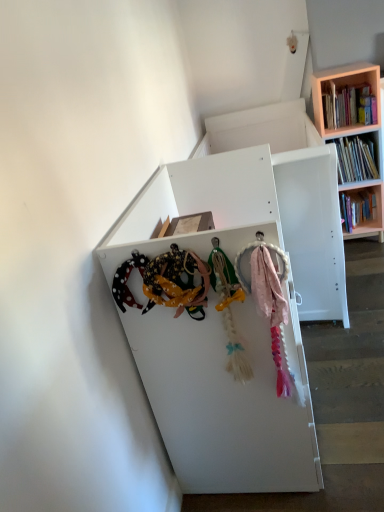
Question: Considering the relative sizes of white matte shelf at center and wooden bookshelf at upper right in the image provided, is white matte shelf at center smaller than wooden bookshelf at upper right?

Choices:
 (A) no
 (B) yes

Answer: (A)

Question: Is white matte shelf at center looking in the opposite direction of wooden bookshelf at upper right?

Choices:
 (A) yes
 (B) no

Answer: (B)

Question: Are white matte shelf at center and wooden bookshelf at upper right located far from each other?

Choices:
 (A) yes
 (B) no

Answer: (A)

Question: Is white matte shelf at center closer to the viewer compared to wooden bookshelf at upper right?

Choices:
 (A) no
 (B) yes

Answer: (B)

Question: Can you confirm if white matte shelf at center is wider than wooden bookshelf at upper right?

Choices:
 (A) yes
 (B) no

Answer: (A)

Question: Considering the relative sizes of white matte shelf at center and wooden bookshelf at upper right in the image provided, is white matte shelf at center taller than wooden bookshelf at upper right?

Choices:
 (A) yes
 (B) no

Answer: (B)

Question: Considering the relative positions of wooden bookshelf at upper right and wooden bookshelf at upper right in the image provided, is wooden bookshelf at upper right to the left of wooden bookshelf at upper right from the viewer's perspective?

Choices:
 (A) no
 (B) yes

Answer: (A)

Question: Can you confirm if wooden bookshelf at upper right is smaller than wooden bookshelf at upper right?

Choices:
 (A) no
 (B) yes

Answer: (A)

Question: Is wooden bookshelf at upper right not inside wooden bookshelf at upper right?

Choices:
 (A) no
 (B) yes

Answer: (B)

Question: From a real-world perspective, does wooden bookshelf at upper right sit lower than wooden bookshelf at upper right?

Choices:
 (A) yes
 (B) no

Answer: (A)

Question: Is wooden bookshelf at upper right facing away from wooden bookshelf at upper right?

Choices:
 (A) yes
 (B) no

Answer: (A)

Question: Is wooden bookshelf at upper right completely or partially inside wooden bookshelf at upper right?

Choices:
 (A) yes
 (B) no

Answer: (A)

Question: Can you confirm if white matte shelf at center is bigger than wooden bookshelf at upper right?

Choices:
 (A) yes
 (B) no

Answer: (A)